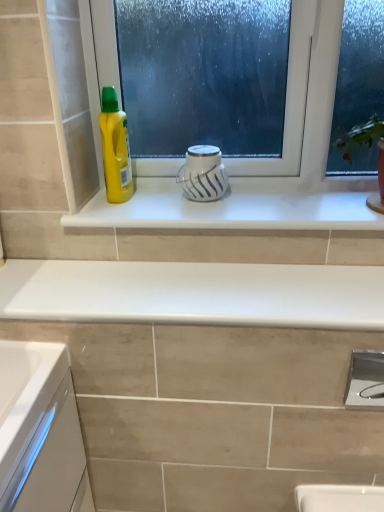
Question: Is yellow plastic bottle at left next to white glossy countertop at center?

Choices:
 (A) yes
 (B) no

Answer: (B)

Question: Is yellow plastic bottle at left not within white glossy countertop at center?

Choices:
 (A) no
 (B) yes

Answer: (B)

Question: Does yellow plastic bottle at left appear on the left side of white glossy countertop at center?

Choices:
 (A) no
 (B) yes

Answer: (B)

Question: Are yellow plastic bottle at left and white glossy countertop at center far apart?

Choices:
 (A) no
 (B) yes

Answer: (A)

Question: Is yellow plastic bottle at left taller than white glossy countertop at center?

Choices:
 (A) no
 (B) yes

Answer: (B)

Question: In the image, is yellow plastic bottle at left positioned in front of or behind white glossy window sill at center?

Choices:
 (A) front
 (B) behind

Answer: (B)

Question: Is yellow plastic bottle at left taller or shorter than white glossy window sill at center?

Choices:
 (A) tall
 (B) short

Answer: (A)

Question: Is point (129, 172) closer or farther from the camera than point (253, 182)?

Choices:
 (A) farther
 (B) closer

Answer: (B)

Question: From the image's perspective, is yellow plastic bottle at left positioned above or below white glossy window sill at center?

Choices:
 (A) below
 (B) above

Answer: (B)

Question: Considering the positions of white glossy countertop at center and white glossy mug at center in the image, is white glossy countertop at center taller or shorter than white glossy mug at center?

Choices:
 (A) tall
 (B) short

Answer: (B)

Question: Is point (62, 289) closer or farther from the camera than point (215, 151)?

Choices:
 (A) farther
 (B) closer

Answer: (B)

Question: From a real-world perspective, relative to white glossy mug at center, is white glossy countertop at center vertically above or below?

Choices:
 (A) below
 (B) above

Answer: (A)

Question: Is white glossy countertop at center situated inside white glossy mug at center or outside?

Choices:
 (A) outside
 (B) inside

Answer: (A)

Question: Considering the positions of white glossy mug at center and white glossy window sill at center in the image, is white glossy mug at center taller or shorter than white glossy window sill at center?

Choices:
 (A) short
 (B) tall

Answer: (B)

Question: From a real-world perspective, is white glossy mug at center physically located above or below white glossy window sill at center?

Choices:
 (A) above
 (B) below

Answer: (A)